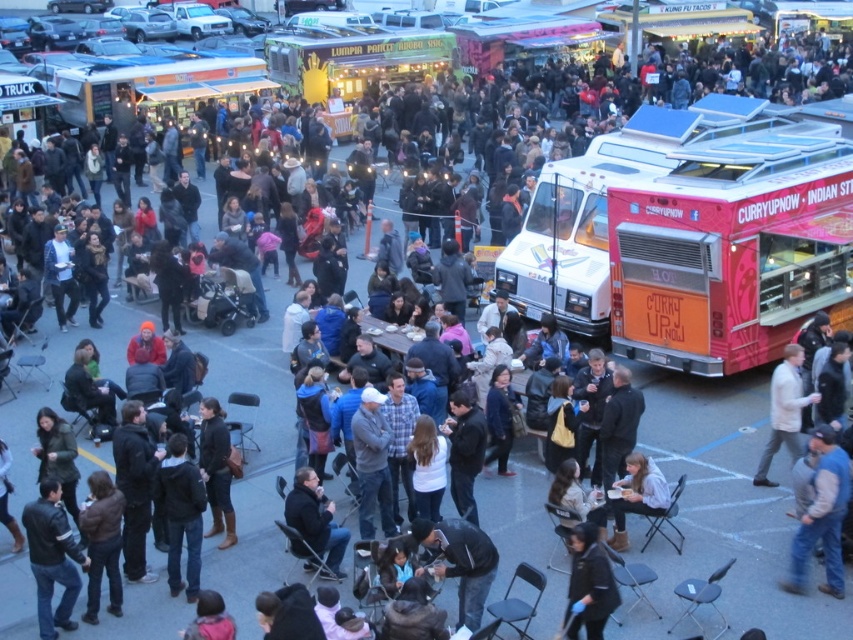
Describe the element at coordinates (315, 520) in the screenshot. I see `dark gray jacket at center` at that location.

You are a GUI agent. You are given a task and a screenshot of the screen. Output one action in this format:
    pyautogui.click(x=<x>, y=<y>)
    Task: Click on the dark gray jacket at center
    This screenshot has width=853, height=640.
    Given the screenshot: What is the action you would take?
    pyautogui.click(x=315, y=520)

Does point (292, 497) come farther from viewer compared to point (631, 465)?

No, (292, 497) is closer to viewer.

Image resolution: width=853 pixels, height=640 pixels. Identify the location of dark gray jacket at center. (315, 520).

Does leather jacket at lower left appear on the right side of light blue shirt at lower center?

Incorrect, leather jacket at lower left is not on the right side of light blue shirt at lower center.

Identify the location of leather jacket at lower left. Image resolution: width=853 pixels, height=640 pixels. tap(51, 557).

Find the location of `leather jacket at lower left`. leather jacket at lower left is located at coordinates (51, 557).

You are a GUI agent. You are given a task and a screenshot of the screen. Output one action in this format:
    pyautogui.click(x=<x>, y=<y>)
    Task: Click on the orange matte food truck at right
    The height and width of the screenshot is (640, 853).
    Given the screenshot: What is the action you would take?
    pyautogui.click(x=732, y=248)

Measure the distance between point (x=746, y=148) and camera.

Point (x=746, y=148) and camera are 17.90 meters apart.

Who is more forward, (682, 234) or (486, 550)?

Point (486, 550) is in front.

The image size is (853, 640). I want to click on orange matte food truck at right, so click(x=732, y=248).